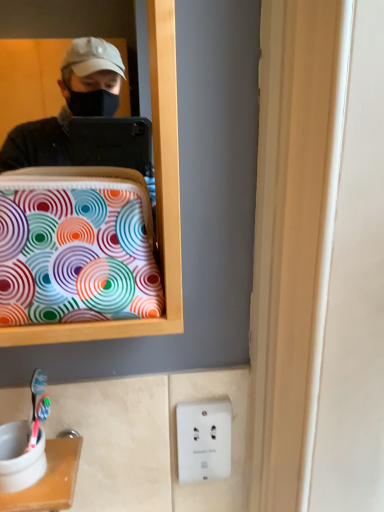
Question: Is point (13, 509) positioned closer to the camera than point (120, 282)?

Choices:
 (A) farther
 (B) closer

Answer: (A)

Question: Based on their sizes in the image, would you say white plastic toothbrush holder at lower left is bigger or smaller than colorful fabric bag at left?

Choices:
 (A) big
 (B) small

Answer: (B)

Question: Based on their relative distances, which object is farther from the white plastic electric outlet at lower center?

Choices:
 (A) white plastic toothbrush holder at lower left
 (B) colorful fabric bag at left

Answer: (B)

Question: Estimate the real-world distances between objects in this image. Which object is farther from the colorful fabric bag at left?

Choices:
 (A) white plastic toothbrush holder at lower left
 (B) white plastic electric outlet at lower center

Answer: (B)